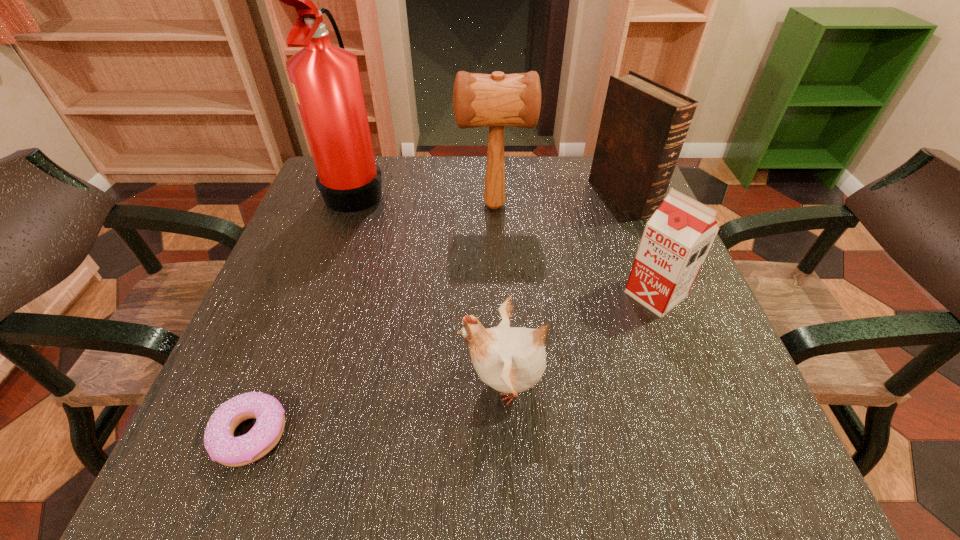
The height and width of the screenshot is (540, 960). I want to click on vacant space located on the strike surface of the mallet, so click(402, 206).

Find the location of a particular element. The height and width of the screenshot is (540, 960). free space located on the front of the third tallest object is located at coordinates (671, 319).

I want to click on free location located on the back of the third nearest object, so click(x=617, y=193).

Where is `free space located 0.320m at the beak of the bird`? free space located 0.320m at the beak of the bird is located at coordinates (260, 383).

Identify the location of free space located 0.340m at the beak of the bird. The height and width of the screenshot is (540, 960). (248, 383).

Identify the location of vacant area located at the beak of the bird. (304, 383).

The height and width of the screenshot is (540, 960). Find the location of `vacant point located 0.310m on the back of the doughnut`. vacant point located 0.310m on the back of the doughnut is located at coordinates tap(314, 264).

The image size is (960, 540). Find the location of `fire extinguisher that is at the far edge`. fire extinguisher that is at the far edge is located at coordinates (326, 81).

You are a GUI agent. You are given a task and a screenshot of the screen. Output one action in this format:
    pyautogui.click(x=<x>, y=<y>)
    Task: Click on the mallet that is at the far edge
    
    Given the screenshot: What is the action you would take?
    pyautogui.click(x=497, y=100)

The image size is (960, 540). I want to click on Bible located at the far edge, so click(x=644, y=124).